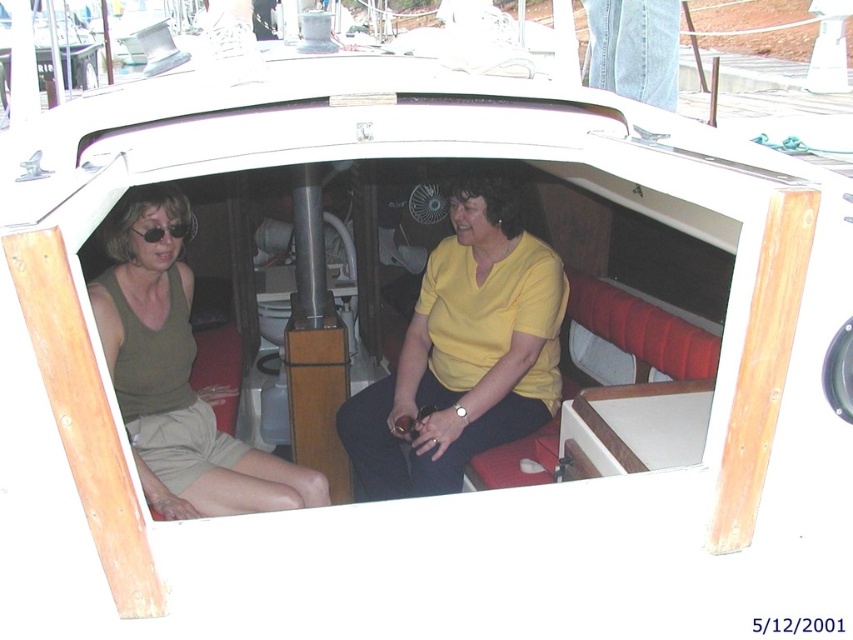
Question: Which object appears farthest from the camera in this image?

Choices:
 (A) yellow matte shirt at center
 (B) matte green tank top at left
 (C) matte black sunglasses at left

Answer: (A)

Question: Does yellow matte shirt at center come in front of matte green tank top at left?

Choices:
 (A) no
 (B) yes

Answer: (A)

Question: In this image, where is matte green tank top at left located relative to matte black sunglasses at left?

Choices:
 (A) above
 (B) below

Answer: (B)

Question: Where is yellow matte shirt at center located in relation to matte black sunglasses at left in the image?

Choices:
 (A) left
 (B) right

Answer: (B)

Question: Which point is closer to the camera?

Choices:
 (A) matte black sunglasses at left
 (B) matte green tank top at left
 (C) yellow matte shirt at center

Answer: (B)

Question: Which object is farther from the camera taking this photo?

Choices:
 (A) matte green tank top at left
 (B) matte black sunglasses at left

Answer: (B)